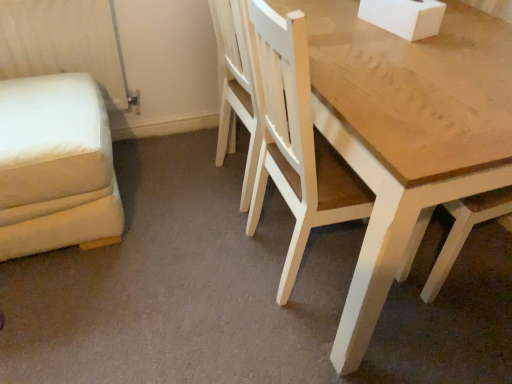
This screenshot has width=512, height=384. Describe the element at coordinates (296, 141) in the screenshot. I see `light wood chair at center` at that location.

Image resolution: width=512 pixels, height=384 pixels. Find the location of `light wood chair at center`. light wood chair at center is located at coordinates (296, 141).

This screenshot has height=384, width=512. What are the coordinates of `white fabric swivel chair at left` in the screenshot? It's located at click(55, 165).

The width and height of the screenshot is (512, 384). What do you see at coordinates (55, 165) in the screenshot? I see `white fabric swivel chair at left` at bounding box center [55, 165].

Find the location of a particular element. This screenshot has height=384, width=512. light wood chair at center is located at coordinates (296, 141).

Considering the relative positions of white fabric swivel chair at left and light wood chair at center in the image provided, is white fabric swivel chair at left to the left or to the right of light wood chair at center?

From the image, it's evident that white fabric swivel chair at left is to the left of light wood chair at center.

Does white fabric swivel chair at left come in front of light wood chair at center?

No, white fabric swivel chair at left is behind light wood chair at center.

Which is closer to the camera, (x=39, y=104) or (x=343, y=174)?

The point (x=343, y=174) is closer.

From the image's perspective, would you say white fabric swivel chair at left is positioned over light wood chair at center?

No, from the image's perspective, white fabric swivel chair at left is not above light wood chair at center.

From a real-world perspective, is white fabric swivel chair at left positioned above or below light wood chair at center?

In terms of real-world spatial position, white fabric swivel chair at left is below light wood chair at center.

Between white fabric swivel chair at left and light wood chair at center, which one has smaller width?

With smaller width is light wood chair at center.

Looking at this image, is white fabric swivel chair at left shorter than light wood chair at center?

Yes, white fabric swivel chair at left is shorter than light wood chair at center.

Considering the relative sizes of white fabric swivel chair at left and light wood chair at center in the image provided, is white fabric swivel chair at left smaller than light wood chair at center?

Indeed, white fabric swivel chair at left has a smaller size compared to light wood chair at center.

From the picture: Does white fabric swivel chair at left contain light wood chair at center?

No, light wood chair at center is not a part of white fabric swivel chair at left.

Is white fabric swivel chair at left not close to light wood chair at center?

That's not correct — white fabric swivel chair at left is a little close to light wood chair at center.

Consider the image. Does white fabric swivel chair at left turn towards light wood chair at center?

No.

How different are the orientations of white fabric swivel chair at left and light wood chair at center in degrees?

The angular difference between white fabric swivel chair at left and light wood chair at center is 89.9 degrees.

Where is `chair above the white fabric swivel chair at left (from the image's perspective)`? chair above the white fabric swivel chair at left (from the image's perspective) is located at coordinates (296, 141).

Which object is positioned more to the left, light wood chair at center or white fabric swivel chair at left?

white fabric swivel chair at left is more to the left.

Considering the positions of objects light wood chair at center and white fabric swivel chair at left in the image provided, who is behind, light wood chair at center or white fabric swivel chair at left?

white fabric swivel chair at left is more distant.

Which is more distant, (304, 121) or (81, 178)?

The point (81, 178) is farther.

From the image's perspective, relative to white fabric swivel chair at left, is light wood chair at center above or below?

From the image's perspective, light wood chair at center appears above white fabric swivel chair at left.

In the scene shown: From a real-world perspective, relative to white fabric swivel chair at left, is light wood chair at center vertically above or below?

In terms of real-world spatial position, light wood chair at center is above white fabric swivel chair at left.

From the picture: Which object is thinner, light wood chair at center or white fabric swivel chair at left?

light wood chair at center.

Is light wood chair at center taller than white fabric swivel chair at left?

Yes, light wood chair at center is taller than white fabric swivel chair at left.

Looking at the image, does light wood chair at center seem bigger or smaller compared to white fabric swivel chair at left?

light wood chair at center is bigger than white fabric swivel chair at left.

Could white fabric swivel chair at left be considered to be inside light wood chair at center?

No, light wood chair at center does not contain white fabric swivel chair at left.

Based on the photo, is light wood chair at center next to white fabric swivel chair at left and touching it?

There is a gap between light wood chair at center and white fabric swivel chair at left.

Could you tell me if light wood chair at center is turned towards white fabric swivel chair at left?

No, light wood chair at center is not turned towards white fabric swivel chair at left.

Locate an element on the screen. swivel chair below the light wood chair at center (from the image's perspective) is located at coordinates (55, 165).

Locate an element on the screen. chair lying in front of the white fabric swivel chair at left is located at coordinates (296, 141).

Locate an element on the screen. Image resolution: width=512 pixels, height=384 pixels. swivel chair that is below the light wood chair at center (from the image's perspective) is located at coordinates (55, 165).